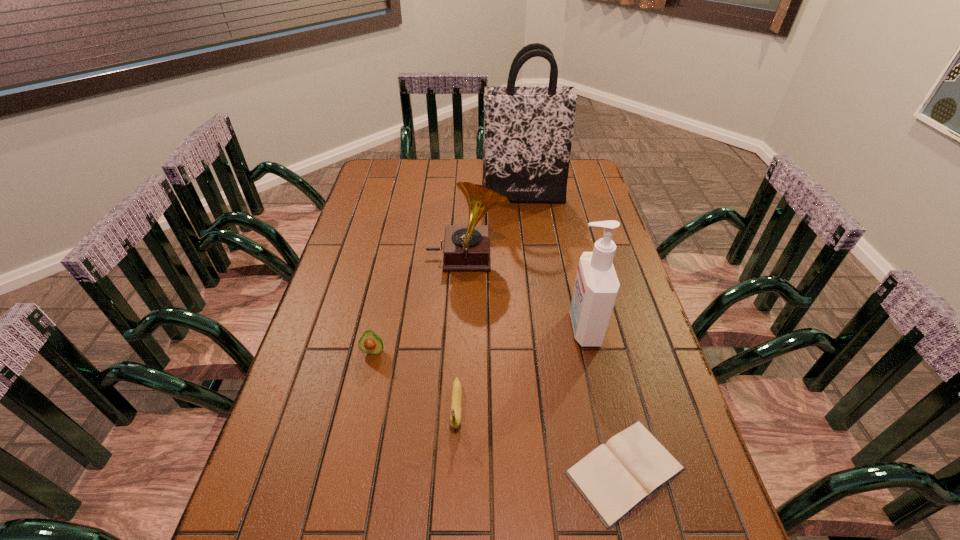
Find the location of a particular element. The image size is (960, 540). Bible situated at the right edge is located at coordinates (616, 477).

The height and width of the screenshot is (540, 960). Identify the location of object that is at the far right corner. (528, 130).

Identify the location of free location at the far edge of the desktop. (445, 179).

The width and height of the screenshot is (960, 540). What are the coordinates of `blank space at the left edge` in the screenshot? It's located at (357, 204).

You are a GUI agent. You are given a task and a screenshot of the screen. Output one action in this format:
    pyautogui.click(x=<x>, y=<y>)
    Task: Click on the vacant space at the right edge of the desktop
    The height and width of the screenshot is (540, 960).
    Given the screenshot: What is the action you would take?
    pyautogui.click(x=592, y=232)

You are a GUI agent. You are given a task and a screenshot of the screen. Output one action in this format:
    pyautogui.click(x=<x>, y=<y>)
    Task: Click on the vacant space at the far left corner of the desktop
    
    Given the screenshot: What is the action you would take?
    pyautogui.click(x=371, y=187)

Locate an element on the screen. free spot between the banana and the tallest object is located at coordinates (490, 301).

Locate an element on the screen. The width and height of the screenshot is (960, 540). free spot between the Bible and the fifth nearest object is located at coordinates (546, 364).

This screenshot has width=960, height=540. Find the location of `free spot between the banana and the shortest object`. free spot between the banana and the shortest object is located at coordinates (540, 438).

This screenshot has width=960, height=540. What are the coordinates of `vacant point located between the leftmost object and the Bible` in the screenshot? It's located at (499, 410).